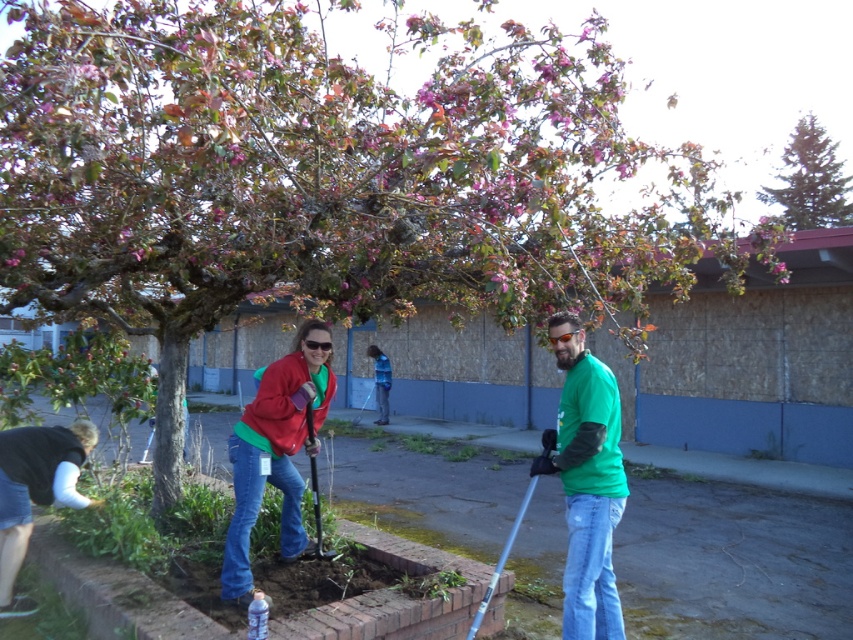
You are a photographer trying to capture a clear shot of both the green matte shirt at center and the metallic silver shovel at center. Since you want both subjects to be in focus, you need to know their relative positions. Which object is located to the right of the other?

The green matte shirt at center is positioned on the right side of metallic silver shovel at center, so the green matte shirt at center is to the right of the metallic silver shovel at center.

Looking at this image, you are a photographer trying to capture a closeup of the green matte shirt at center and the metallic silver shovel at center. Which object should you zoom in on more to ensure both are in focus?

The green matte shirt at center is wider than the metallic silver shovel at center, so you should zoom in more on the metallic silver shovel at center to ensure both are in focus.

What object is located at the coordinates point (587, 483)?

The object at point (587, 483) is the green matte shirt at center.